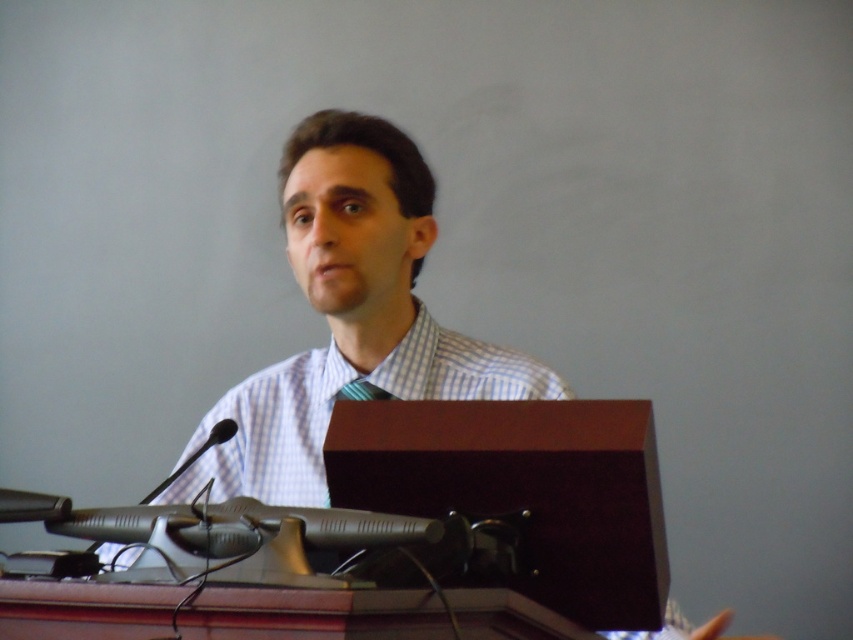
Question: Observing the image, what is the correct spatial positioning of white checkered shirt at center in reference to metallic silver microphone at left?

Choices:
 (A) below
 (B) above

Answer: (B)

Question: Among these objects, which one is nearest to the camera?

Choices:
 (A) white checkered shirt at center
 (B) metallic silver microphone at left

Answer: (B)

Question: Which object is farther from the camera taking this photo?

Choices:
 (A) white checkered shirt at center
 (B) metallic silver microphone at left

Answer: (A)

Question: Is white checkered shirt at center to the right of metallic silver microphone at left from the viewer's perspective?

Choices:
 (A) yes
 (B) no

Answer: (A)

Question: Which object appears farthest from the camera in this image?

Choices:
 (A) metallic silver microphone at left
 (B) white checkered shirt at center

Answer: (B)

Question: Does white checkered shirt at center have a larger size compared to metallic silver microphone at left?

Choices:
 (A) no
 (B) yes

Answer: (B)